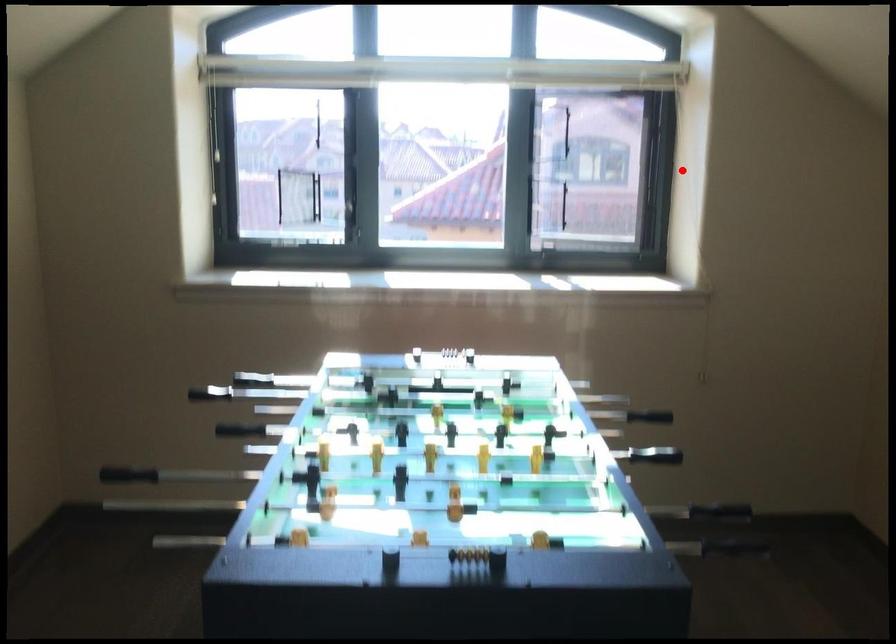
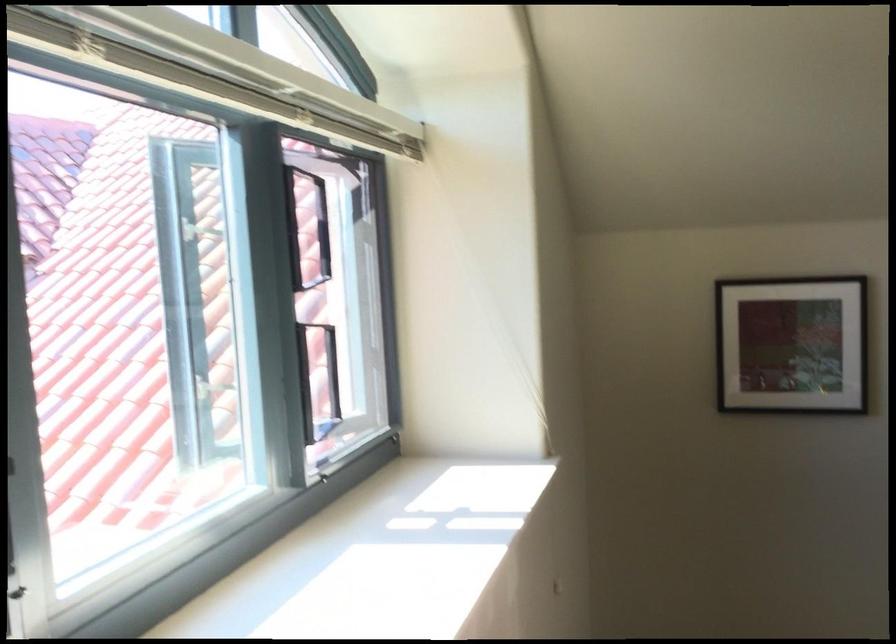
Question: A red point is marked in image1. In image2, is the corresponding 3D point closer to the camera or farther? Reply with the corresponding letter.

Choices:
 (A) The corresponding 3D point is closer.
 (B) The corresponding 3D point is farther.

Answer: (A)